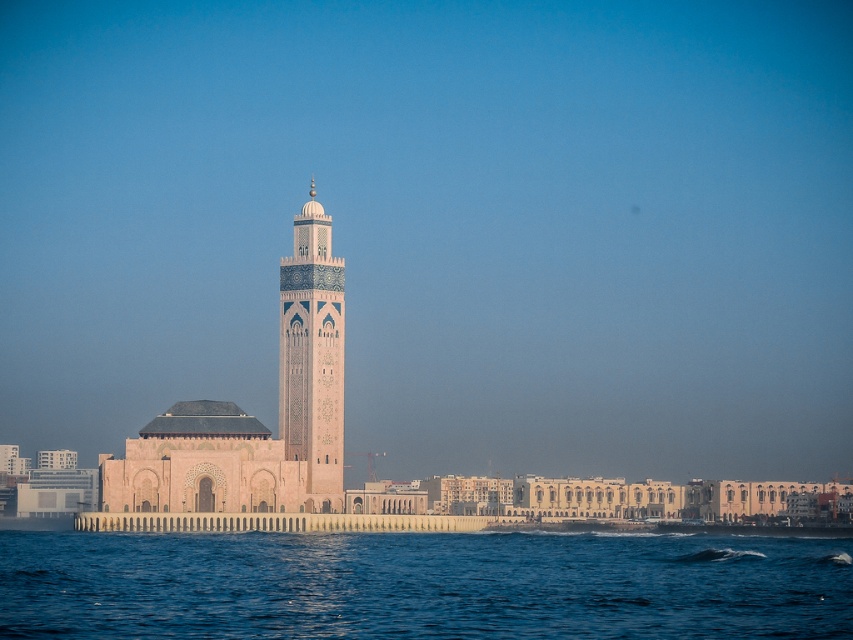
Question: Where is blue water at lower center located in relation to pink stone minaret at center in the image?

Choices:
 (A) right
 (B) left

Answer: (A)

Question: Which point is closer to the camera?

Choices:
 (A) blue water at lower center
 (B) pink stone minaret at center

Answer: (A)

Question: Which point is closer to the camera?

Choices:
 (A) pink stone minaret at center
 (B) blue water at lower center

Answer: (B)

Question: Is blue water at lower center in front of pink stone minaret at center?

Choices:
 (A) no
 (B) yes

Answer: (B)

Question: Which point is closer to the camera taking this photo?

Choices:
 (A) (601, 576)
 (B) (316, 288)

Answer: (A)

Question: Is blue water at lower center to the right of pink stone minaret at center from the viewer's perspective?

Choices:
 (A) yes
 (B) no

Answer: (A)